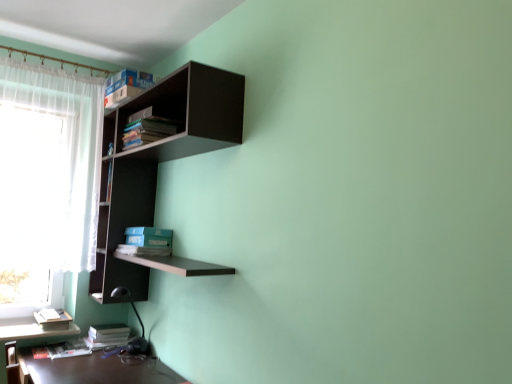
Describe the element at coordinates (158, 161) in the screenshot. The image size is (512, 384). I see `dark wood shelf at upper left` at that location.

Describe the element at coordinates (53, 320) in the screenshot. I see `white paper book at lower left, marked as the 3th book in a top-to-bottom arrangement` at that location.

I want to click on brown wooden table at lower left, so click(96, 370).

What do you see at coordinates (96, 370) in the screenshot? This screenshot has width=512, height=384. I see `brown wooden table at lower left` at bounding box center [96, 370].

What do you see at coordinates (68, 349) in the screenshot? I see `hardcover book at lower left, the fifth book viewed from the top` at bounding box center [68, 349].

Describe the element at coordinates (147, 131) in the screenshot. Image resolution: width=512 pixels, height=384 pixels. I see `matte black book at upper center, the 1th book in the top-to-bottom sequence` at that location.

Image resolution: width=512 pixels, height=384 pixels. Find the location of `dark wood shelf at upper left`. dark wood shelf at upper left is located at coordinates (158, 161).

Which object is positioned more to the left, white sheer curtain at left or brown wooden table at lower left?

Positioned to the left is white sheer curtain at left.

Between white sheer curtain at left and brown wooden table at lower left, which one has smaller width?

Thinner between the two is white sheer curtain at left.

Is white sheer curtain at left taller than brown wooden table at lower left?

Yes, white sheer curtain at left is taller than brown wooden table at lower left.

Which is more to the left, white sheer curtain at left or dark wood shelf at upper left?

white sheer curtain at left.

From a real-world perspective, is white sheer curtain at left positioned under dark wood shelf at upper left based on gravity?

No, from a real-world perspective, white sheer curtain at left is not under dark wood shelf at upper left.

Does white sheer curtain at left turn towards dark wood shelf at upper left?

No, white sheer curtain at left is not turned towards dark wood shelf at upper left.

Considering the relative sizes of white paper book at lower left, which is the third book from bottom to top, and dark wood shelf at upper left in the image provided, is white paper book at lower left, which is the third book from bottom to top, taller than dark wood shelf at upper left?

No.

Considering the relative positions of white paper book at lower left, which is the third book from bottom to top, and dark wood shelf at upper left in the image provided, is white paper book at lower left, which is the third book from bottom to top, to the left or to the right of dark wood shelf at upper left?

white paper book at lower left, which is the third book from bottom to top, is to the left of dark wood shelf at upper left.

Looking at this image, does white paper book at lower left, marked as the 3th book in a top-to-bottom arrangement, turn towards dark wood shelf at upper left?

No, white paper book at lower left, marked as the 3th book in a top-to-bottom arrangement, is not aimed at dark wood shelf at upper left.

Consider the image. Which of these two, white paper book at lower left, which is the third book from bottom to top, or dark wood shelf at upper left, is bigger?

dark wood shelf at upper left.

From the picture: Is there a large distance between hardcover book at lower left, the first book positioned from the bottom, and matte black book at upper center, the 1th book in the top-to-bottom sequence?

Yes, hardcover book at lower left, the first book positioned from the bottom, and matte black book at upper center, the 1th book in the top-to-bottom sequence, are quite far apart.

Does hardcover book at lower left, the first book positioned from the bottom, appear on the left side of matte black book at upper center, the 1th book in the top-to-bottom sequence?

Correct, you'll find hardcover book at lower left, the first book positioned from the bottom, to the left of matte black book at upper center, the 1th book in the top-to-bottom sequence.

Which of these two, hardcover book at lower left, the first book positioned from the bottom, or matte black book at upper center, the 1th book in the top-to-bottom sequence, stands shorter?

Standing shorter between the two is hardcover book at lower left, the first book positioned from the bottom.

From a real-world perspective, is hardcover book at lower left, the first book positioned from the bottom, located beneath matte black book at upper center, which is the fifth book in bottom-to-top order?

Yes, from a real-world perspective, hardcover book at lower left, the first book positioned from the bottom, is under matte black book at upper center, which is the fifth book in bottom-to-top order.

Does matte black book at upper center, the 1th book in the top-to-bottom sequence, have a smaller size compared to hardcover book at lower left, acting as the fourth book starting from the top?

No.

From the image's perspective, is matte black book at upper center, the 1th book in the top-to-bottom sequence, over hardcover book at lower left, the 2th book in the bottom-to-top sequence?

Correct, matte black book at upper center, the 1th book in the top-to-bottom sequence, appears higher than hardcover book at lower left, the 2th book in the bottom-to-top sequence, in the image.

From a real-world perspective, does matte black book at upper center, the 1th book in the top-to-bottom sequence, stand above hardcover book at lower left, the 2th book in the bottom-to-top sequence?

Yes, from a real-world perspective, matte black book at upper center, the 1th book in the top-to-bottom sequence, is over hardcover book at lower left, the 2th book in the bottom-to-top sequence

Which object is closer to the camera taking this photo, matte black book at upper center, which is the fifth book in bottom-to-top order, or hardcover book at lower left, acting as the fourth book starting from the top?

matte black book at upper center, which is the fifth book in bottom-to-top order, is in front.

Considering the sizes of objects white paper book at lower left, marked as the 3th book in a top-to-bottom arrangement, and white sheer curtain at left in the image provided, who is taller, white paper book at lower left, marked as the 3th book in a top-to-bottom arrangement, or white sheer curtain at left?

With more height is white sheer curtain at left.

In the image, is white paper book at lower left, which is the third book from bottom to top, positioned in front of or behind white sheer curtain at left?

In the image, white paper book at lower left, which is the third book from bottom to top, appears behind white sheer curtain at left.

Is white paper book at lower left, which is the third book from bottom to top, far from white sheer curtain at left?

No, white paper book at lower left, which is the third book from bottom to top, is not far from white sheer curtain at left.

Locate an element on the screen. The image size is (512, 384). curtain on the right of white paper book at lower left, which is the third book from bottom to top is located at coordinates (59, 163).

Which is more to the right, hardcover book at lower left, acting as the fourth book starting from the top, or brown wooden table at lower left?

brown wooden table at lower left is more to the right.

Is hardcover book at lower left, acting as the fourth book starting from the top, surrounding brown wooden table at lower left?

Actually, brown wooden table at lower left is outside hardcover book at lower left, acting as the fourth book starting from the top.

How many degrees apart are the facing directions of hardcover book at lower left, the 2th book in the bottom-to-top sequence, and brown wooden table at lower left?

hardcover book at lower left, the 2th book in the bottom-to-top sequence, and brown wooden table at lower left are facing 0.529 degrees away from each other.

Can you confirm if hardcover book at lower left, acting as the fourth book starting from the top, is taller than brown wooden table at lower left?

No, hardcover book at lower left, acting as the fourth book starting from the top, is not taller than brown wooden table at lower left.

Image resolution: width=512 pixels, height=384 pixels. Identify the location of curtain above the brown wooden table at lower left (from a real-world perspective). tap(59, 163).

I want to click on shelf that is below the white sheer curtain at left (from the image's perspective), so click(x=158, y=161).

Which object lies further to the anchor point white paper book at lower left, marked as the 3th book in a top-to-bottom arrangement, hardcover book at lower left, the fifth book viewed from the top, or hardcover book at lower left, acting as the fourth book starting from the top?

Among the two, hardcover book at lower left, acting as the fourth book starting from the top, is located further to white paper book at lower left, marked as the 3th book in a top-to-bottom arrangement.

Looking at this image, based on their spatial positions, is white paper book at lower left, marked as the 3th book in a top-to-bottom arrangement, or dark wood shelf at upper left further from white sheer curtain at left?

white paper book at lower left, marked as the 3th book in a top-to-bottom arrangement, is further to white sheer curtain at left.

Which object lies nearer to the anchor point white sheer curtain at left, hardcover book at lower left, acting as the fourth book starting from the top, or hardcover book at lower left, the fifth book viewed from the top?

hardcover book at lower left, acting as the fourth book starting from the top, is positioned closer to the anchor white sheer curtain at left.

From the image, which object appears to be farther from brown wooden table at lower left, hardcover book at lower left, the first book positioned from the bottom, or dark wood shelf at upper left?

dark wood shelf at upper left is further to brown wooden table at lower left.

When comparing their distances from dark wood shelf at upper left, does white sheer curtain at left or white paper book at lower left, which is the third book from bottom to top, seem closer?

white sheer curtain at left lies closer to dark wood shelf at upper left than the other object.

Which object lies nearer to the anchor point hardcover book at lower left, the fifth book viewed from the top, brown wooden table at lower left or dark wood shelf at upper left?

The object closer to hardcover book at lower left, the fifth book viewed from the top, is brown wooden table at lower left.

Estimate the real-world distances between objects in this image. Which object is closer to dark wood shelf at upper left, hardcover book at lower left, the 2th book in the bottom-to-top sequence, or brown wooden table at lower left?

brown wooden table at lower left lies closer to dark wood shelf at upper left than the other object.

Which object lies nearer to the anchor point dark wood shelf at upper left, hardcover book at lower left, the first book positioned from the bottom, or matte black book at upper center, which is the fifth book in bottom-to-top order?

matte black book at upper center, which is the fifth book in bottom-to-top order, is positioned closer to the anchor dark wood shelf at upper left.

Find the location of a particular element. shelf that lies between matte black book at upper center, which is the fifth book in bottom-to-top order, and hardcover book at lower left, acting as the fourth book starting from the top, from top to bottom is located at coordinates (158, 161).

What are the coordinates of `shelf between matte black book at upper center, which is the fifth book in bottom-to-top order, and hardcover book at lower left, the fifth book viewed from the top, vertically` in the screenshot? It's located at (158, 161).

What are the coordinates of `book between white paper book at lower left, marked as the 3th book in a top-to-bottom arrangement, and hardcover book at lower left, the 2th book in the bottom-to-top sequence` in the screenshot? It's located at coord(68,349).

Image resolution: width=512 pixels, height=384 pixels. In order to click on curtain between matte black book at upper center, which is the fifth book in bottom-to-top order, and brown wooden table at lower left vertically in this screenshot , I will do `click(59, 163)`.